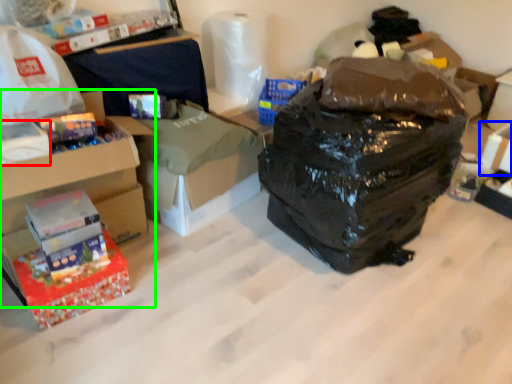
Question: Considering the real-world distances, which object is farthest from box (highlighted by a red box)? storage box (highlighted by a blue box) or box (highlighted by a green box)?

Choices:
 (A) storage box
 (B) box

Answer: (A)